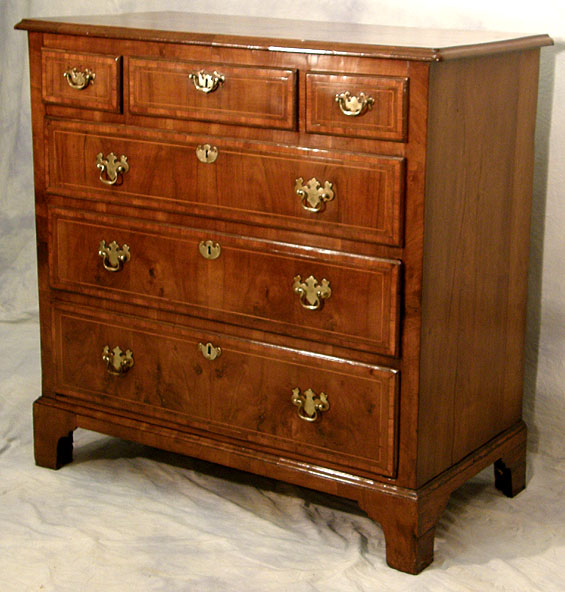
Identify the location of handle. (295, 413).